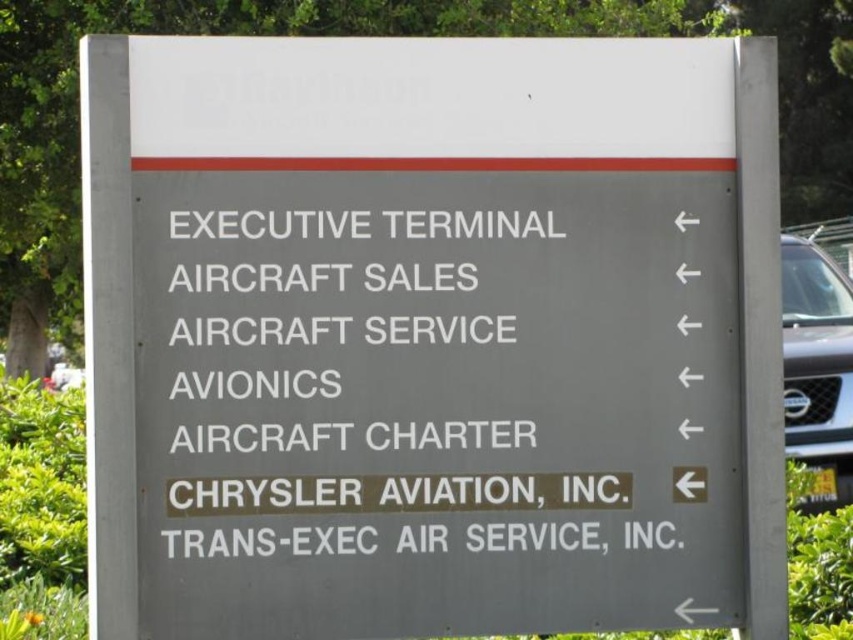
Question: Can you confirm if white text on gray sign at center is positioned to the right of satin silver suv at right?

Choices:
 (A) no
 (B) yes

Answer: (A)

Question: Does white text on gray sign at center have a smaller size compared to satin silver suv at right?

Choices:
 (A) yes
 (B) no

Answer: (A)

Question: Among these points, which one is farthest from the camera?

Choices:
 (A) pos(807,358)
 (B) pos(618,388)

Answer: (A)

Question: Can you confirm if white text on gray sign at center is positioned to the right of satin silver suv at right?

Choices:
 (A) yes
 (B) no

Answer: (B)

Question: Among these objects, which one is nearest to the camera?

Choices:
 (A) satin silver suv at right
 (B) white text on gray sign at center

Answer: (B)